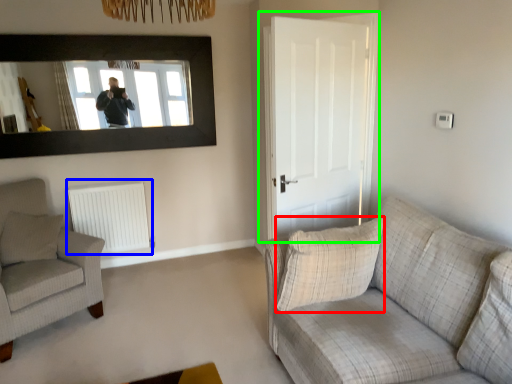
Question: Estimate the real-world distances between objects in this image. Which object is closer to pillow (highlighted by a red box), radiator (highlighted by a blue box) or door (highlighted by a green box)?

Choices:
 (A) radiator
 (B) door

Answer: (B)